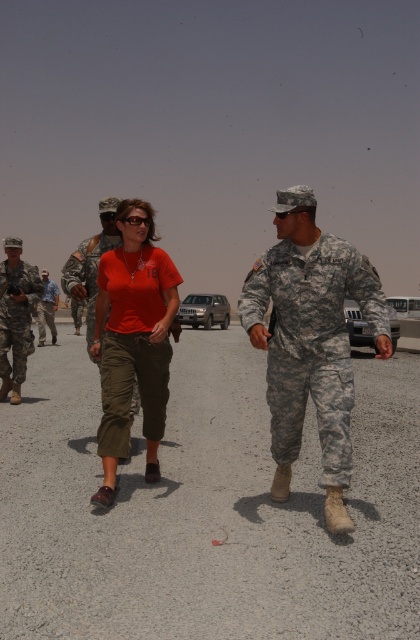
Question: Among these objects, which one is nearest to the camera?

Choices:
 (A) camouflage fabric uniform at center
 (B) camouflage uniform at left

Answer: (A)

Question: Is camouflage uniform at center to the right of camouflage fabric uniform at center from the viewer's perspective?

Choices:
 (A) no
 (B) yes

Answer: (B)

Question: From the image, what is the correct spatial relationship of camouflage uniform at left in relation to camouflage fabric uniform at center?

Choices:
 (A) above
 (B) below

Answer: (B)

Question: Can you confirm if camouflage uniform at center is smaller than camouflage uniform at left?

Choices:
 (A) no
 (B) yes

Answer: (A)

Question: Considering the real-world distances, which object is closest to the camouflage uniform at left?

Choices:
 (A) matte orange t-shirt at center
 (B) camouflage fabric uniform at center

Answer: (B)

Question: Which of the following is the farthest from the observer?

Choices:
 (A) (0, 291)
 (B) (120, 237)
 (C) (115, 381)

Answer: (A)